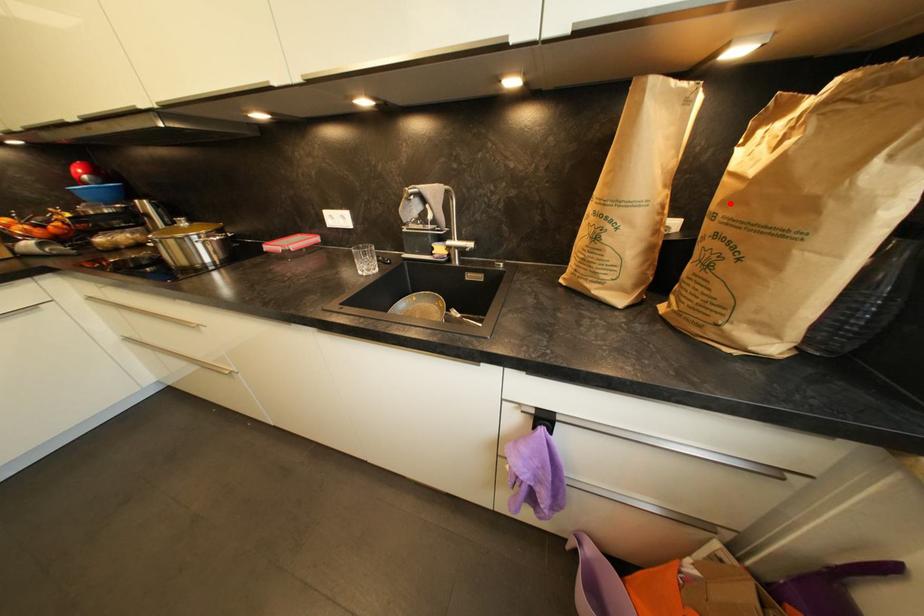
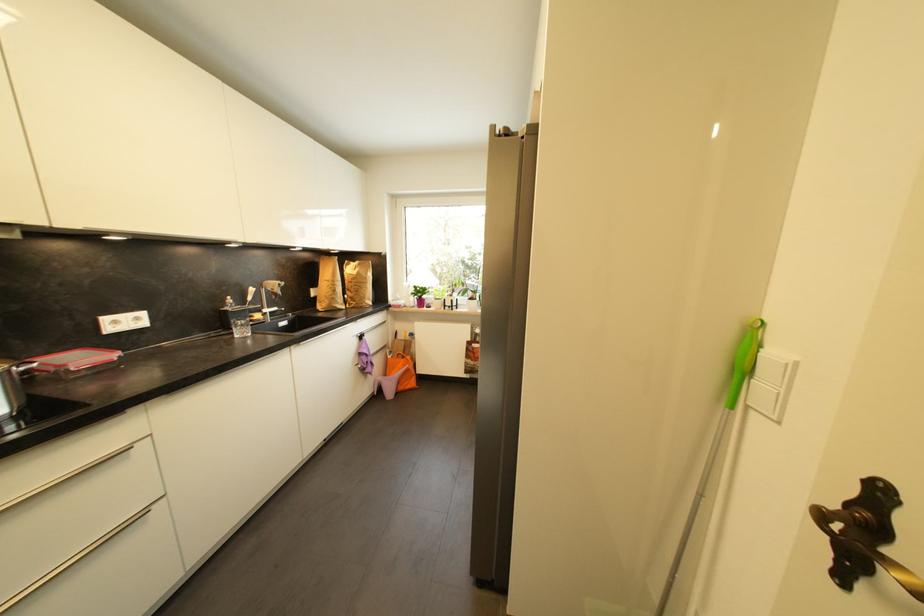
In the second image, find the point that corresponds to the highlighted location in the first image.

(358, 281)